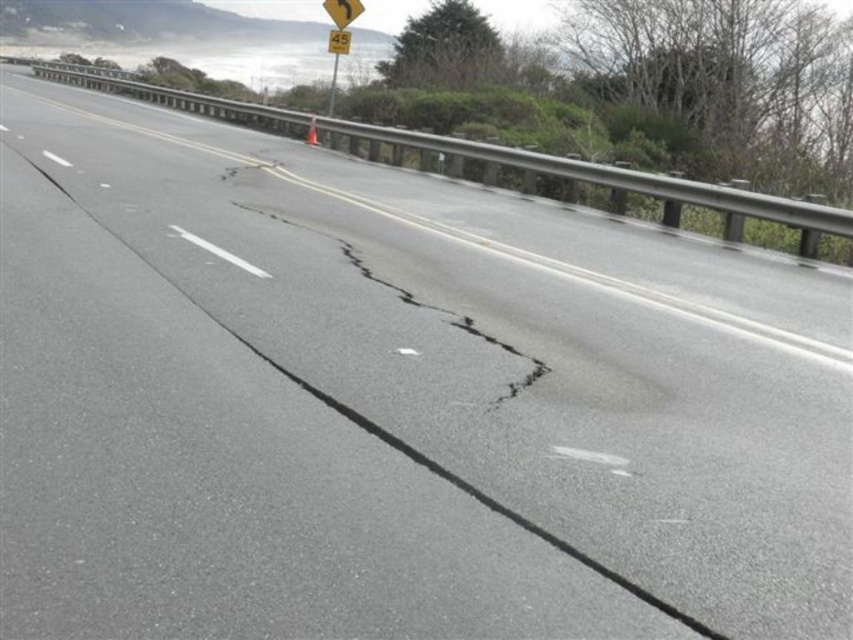
Question: From the image, what is the correct spatial relationship of black asphalt crack at center in relation to yellow matte sign at upper center?

Choices:
 (A) left
 (B) right

Answer: (B)

Question: Can you confirm if black asphalt crack at center is positioned below yellow plastic sign at upper center?

Choices:
 (A) no
 (B) yes

Answer: (B)

Question: Which is farther from the yellow matte sign at upper center?

Choices:
 (A) black asphalt crack at center
 (B) yellow plastic sign at upper center

Answer: (A)

Question: Is black asphalt crack at center bigger than yellow plastic sign at upper center?

Choices:
 (A) no
 (B) yes

Answer: (A)

Question: Which point appears closest to the camera in this image?

Choices:
 (A) click(376, 310)
 (B) click(328, 35)
 (C) click(358, 4)

Answer: (A)

Question: Which of these objects is positioned farthest from the black asphalt crack at center?

Choices:
 (A) yellow plastic sign at upper center
 (B) yellow matte sign at upper center

Answer: (A)